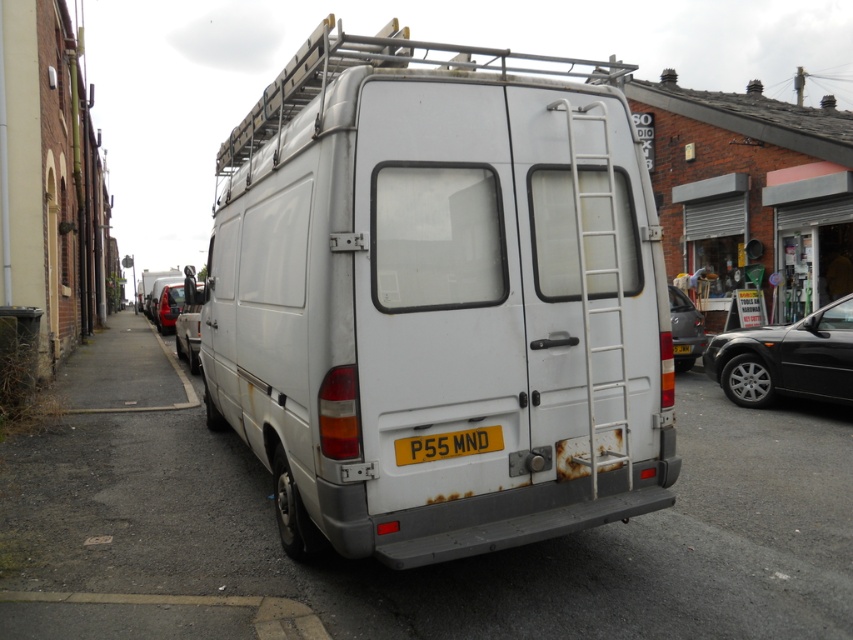
Can you confirm if shiny black sedan at right is wider than metallic silver car at right?

Yes, shiny black sedan at right is wider than metallic silver car at right.

Who is taller, shiny black sedan at right or metallic silver car at right?

metallic silver car at right

This screenshot has width=853, height=640. What do you see at coordinates (786, 358) in the screenshot?
I see `shiny black sedan at right` at bounding box center [786, 358].

Image resolution: width=853 pixels, height=640 pixels. What are the coordinates of `shiny black sedan at right` in the screenshot? It's located at (786, 358).

Who is lower down, white metal ladder at rear or yellow matte license plate at center?

Positioned lower is yellow matte license plate at center.

Between white metal ladder at rear and yellow matte license plate at center, which one appears on the right side from the viewer's perspective?

Positioned to the right is white metal ladder at rear.

Between point (585, 312) and point (485, 444), which one is positioned behind?

Positioned behind is point (585, 312).

Find the location of a particular element. The image size is (853, 640). white metal ladder at rear is located at coordinates 587,292.

Find the location of a particular element. white matte van at center is located at coordinates (440, 298).

What do you see at coordinates (440, 298) in the screenshot? I see `white matte van at center` at bounding box center [440, 298].

Where is `white matte van at center`? This screenshot has height=640, width=853. white matte van at center is located at coordinates (440, 298).